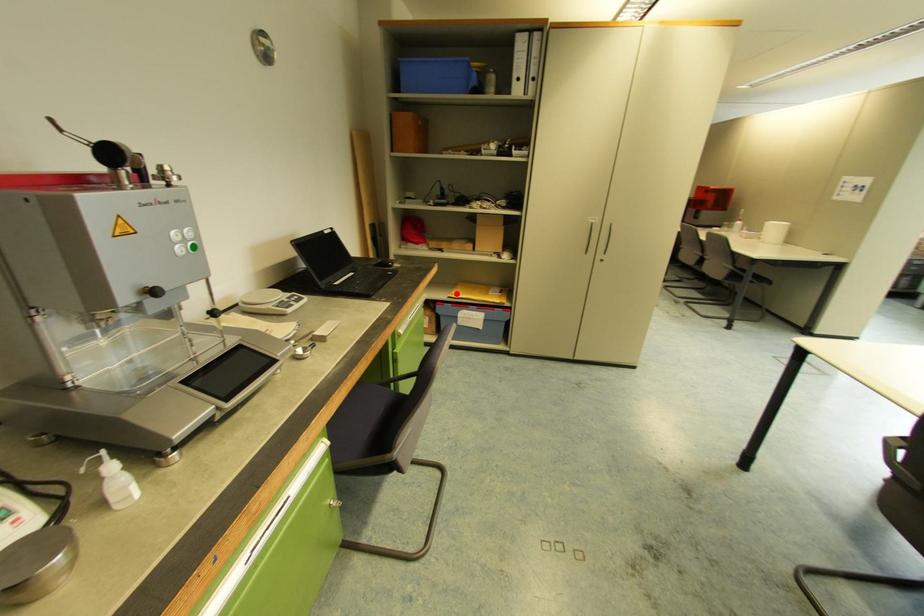
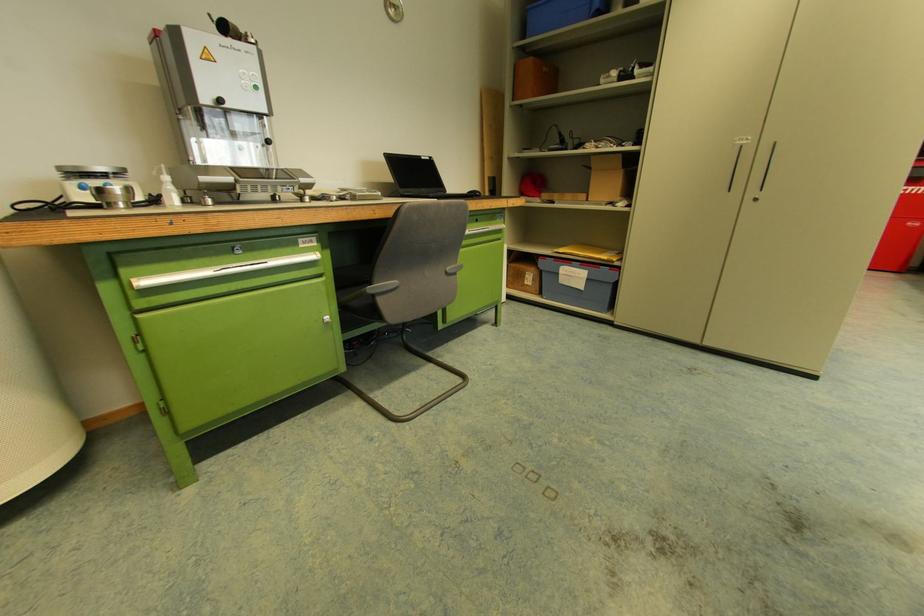
Question: A red point is marked in image1. In image2, is the corresponding 3D point closer to the camera or farther? Reply with the corresponding letter.

Choices:
 (A) The corresponding 3D point is closer.
 (B) The corresponding 3D point is farther.

Answer: (A)